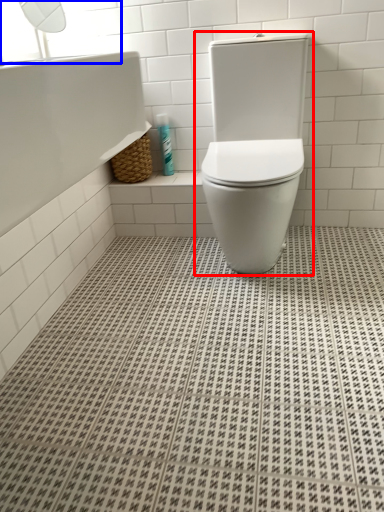
Question: Which of the following is the closest to the observer, toilet (highlighted by a red box) or window screen (highlighted by a blue box)?

Choices:
 (A) toilet
 (B) window screen

Answer: (A)